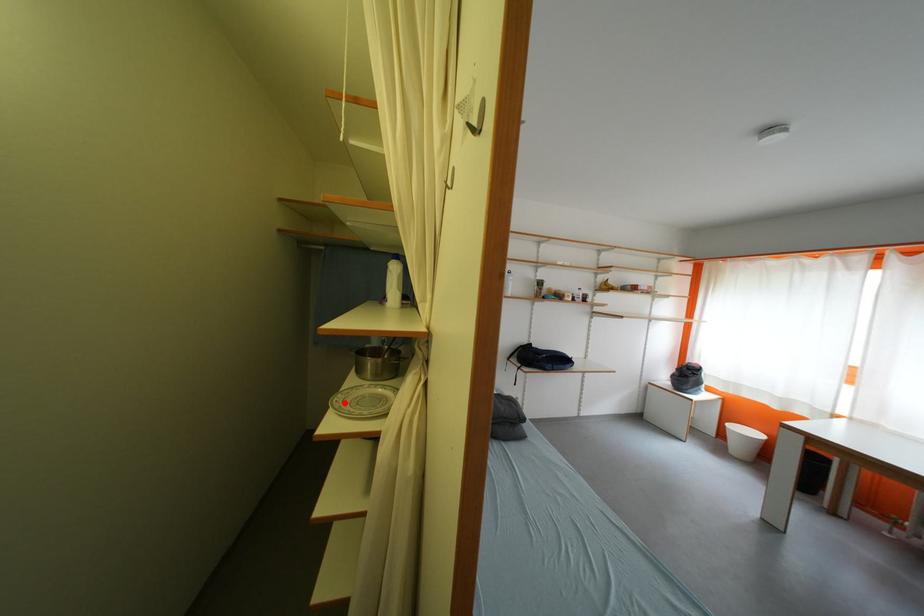
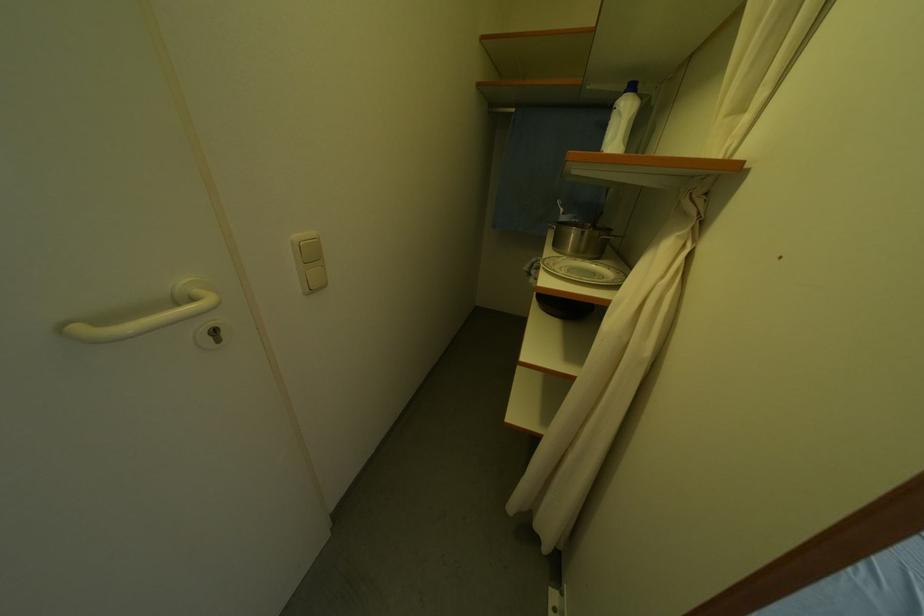
Question: I am providing you with two images of the same scene from different viewpoints. Image1 has a red point marked. In image2, the corresponding 3D location appears at what relative position? Reply with the corresponding letter.

Choices:
 (A) Closer
 (B) Farther

Answer: (A)